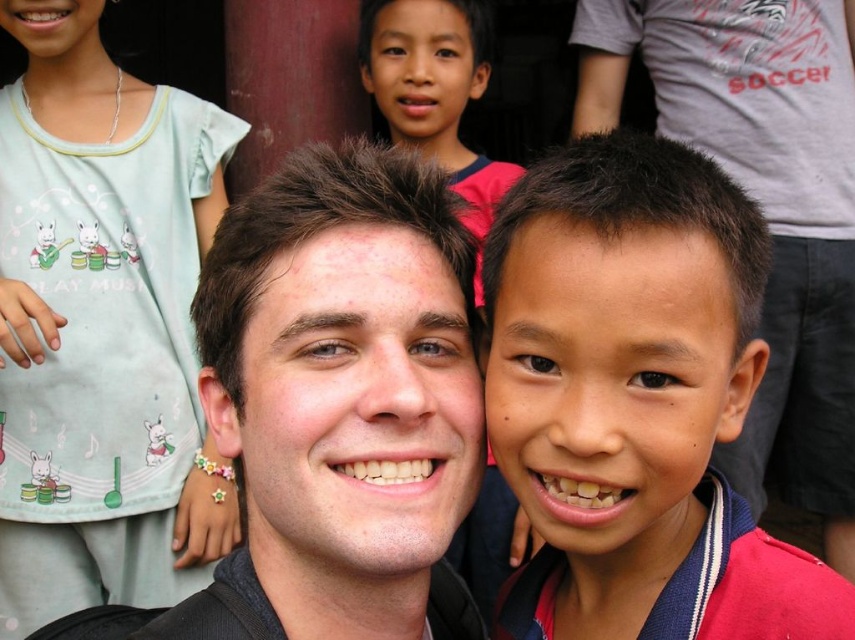
You are a photographer trying to adjust the camera focus. The scene has a light blue fabric shirt at upper left and a smooth skin face at center. Which object should you focus on first if you want to prioritize the closer subject?

The light blue fabric shirt at upper left is taller than smooth skin face at center, so you should focus on the smooth skin face at center first since it is closer to the camera.

Based on the coordinates provided, can you identify which object corresponds to the point at [102,326] in the image?

The point at [102,326] corresponds to the light blue fabric shirt at upper left.

You are a photographer trying to capture a clear shot of the smooth skin boy at center and the light blue fabric shirt at upper left. Which object will appear larger in your photo?

The smooth skin boy at center will appear larger in the photo because it is closer to the viewer than the light blue fabric shirt at upper left.